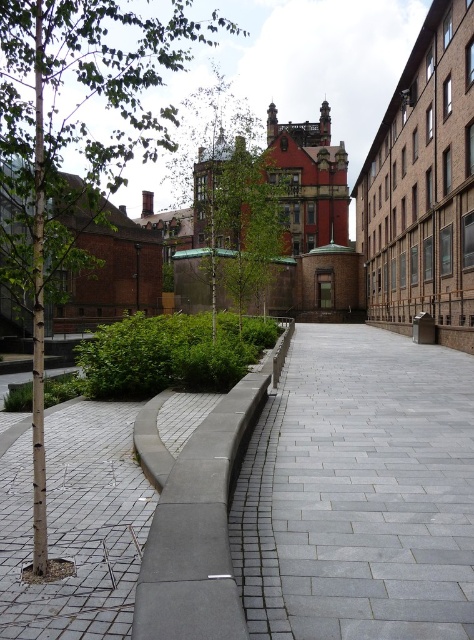
Question: Can you confirm if bark-textured tree at left is positioned to the left of concrete at center?

Choices:
 (A) no
 (B) yes

Answer: (B)

Question: Which object appears farthest from the camera in this image?

Choices:
 (A) gray concrete alley at center
 (B) gray cobblestone pavement at lower left

Answer: (B)

Question: Which of the following is the closest to the observer?

Choices:
 (A) (147, 129)
 (B) (101, 573)
 (C) (437, 422)

Answer: (B)

Question: Considering the relative positions of gray cobblestone pavement at lower left and concrete at center in the image provided, where is gray cobblestone pavement at lower left located with respect to concrete at center?

Choices:
 (A) above
 (B) below

Answer: (B)

Question: Which point is farther to the camera?

Choices:
 (A) gray concrete alley at center
 (B) concrete at center

Answer: (A)

Question: Does bark-textured tree at left appear on the right side of gray cobblestone pavement at lower left?

Choices:
 (A) no
 (B) yes

Answer: (A)